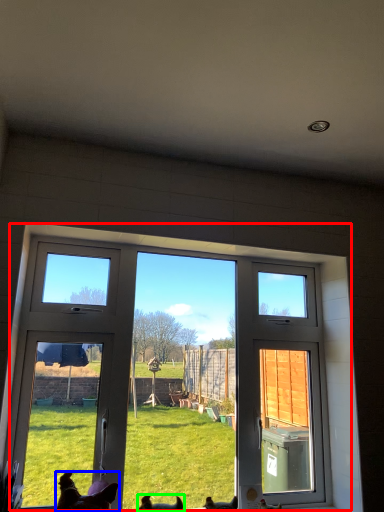
Question: Based on their relative distances, which object is farther from window (highlighted by a red box)? Choose from dog (highlighted by a blue box) and dog (highlighted by a green box).

Choices:
 (A) dog
 (B) dog

Answer: (B)